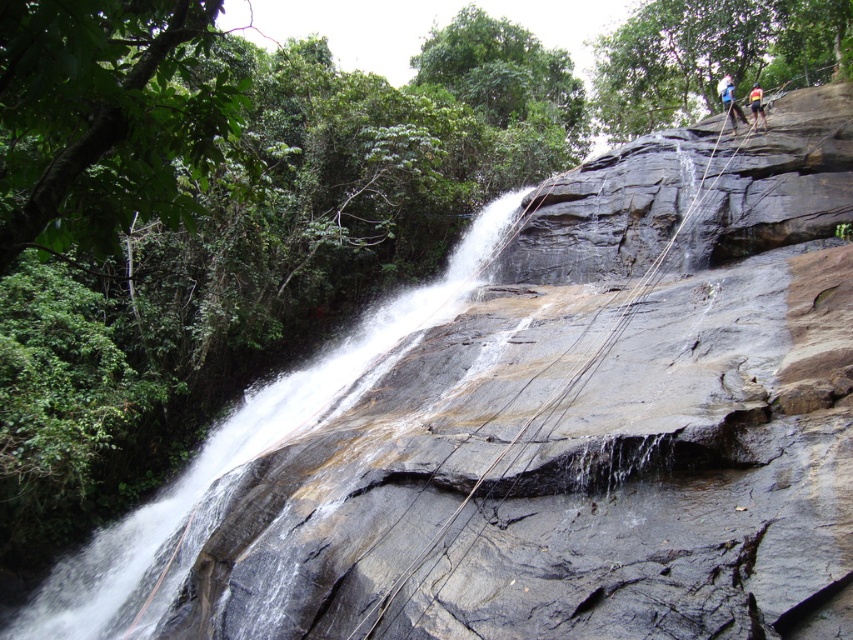
Question: Estimate the real-world distances between objects in this image. Which object is farther from the yellow-orange climbing harness at upper right?

Choices:
 (A) blue fabric harness at upper right
 (B) white smooth waterfall at center

Answer: (B)

Question: Is blue fabric harness at upper right to the right of yellow-orange climbing harness at upper right from the viewer's perspective?

Choices:
 (A) yes
 (B) no

Answer: (B)

Question: Estimate the real-world distances between objects in this image. Which object is farther from the white smooth waterfall at center?

Choices:
 (A) blue fabric harness at upper right
 (B) yellow-orange climbing harness at upper right

Answer: (B)

Question: Which point is closer to the camera?

Choices:
 (A) (752, 104)
 (B) (717, 84)
 (C) (410, 292)

Answer: (A)

Question: Is blue fabric harness at upper right smaller than yellow-orange climbing harness at upper right?

Choices:
 (A) yes
 (B) no

Answer: (B)

Question: Can you confirm if white smooth waterfall at center is thinner than yellow-orange climbing harness at upper right?

Choices:
 (A) yes
 (B) no

Answer: (B)